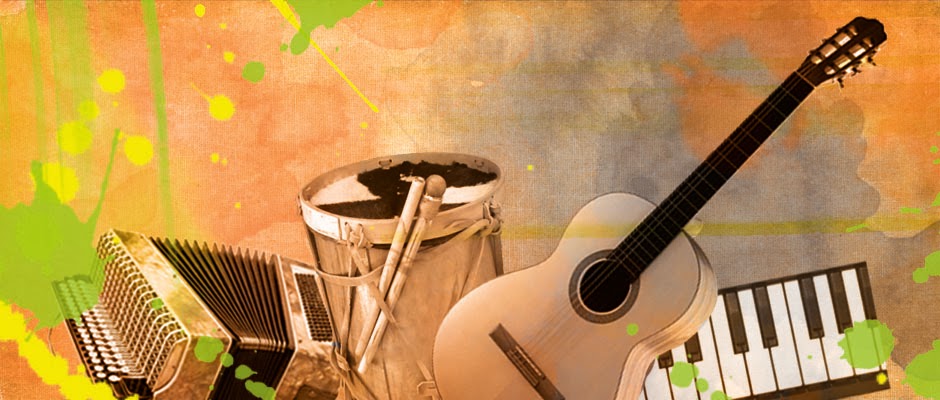
What are the coordinates of `white piano keyboard keys` in the screenshot? It's located at (855, 295), (822, 286), (794, 285), (774, 301), (750, 316), (733, 367), (709, 363), (682, 390), (655, 383), (643, 393).